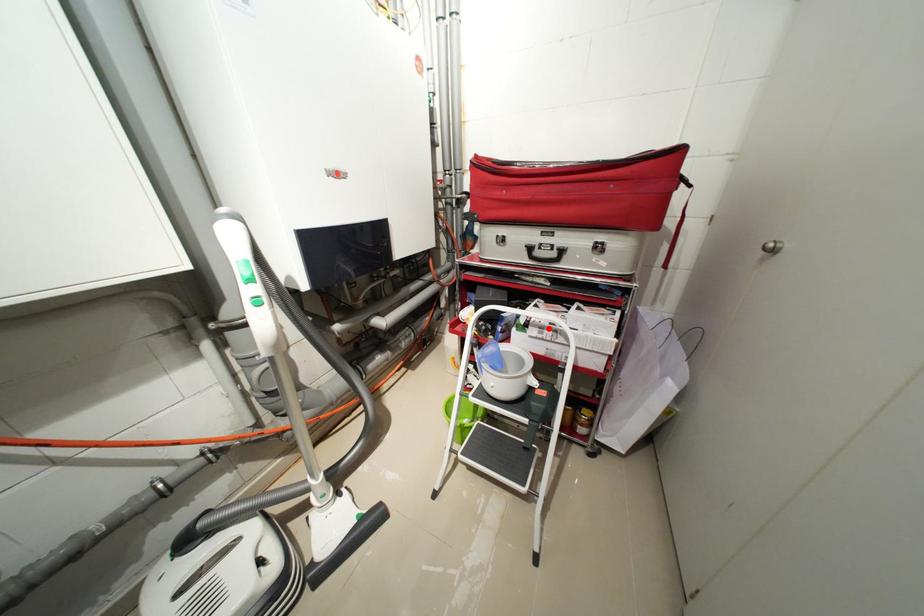
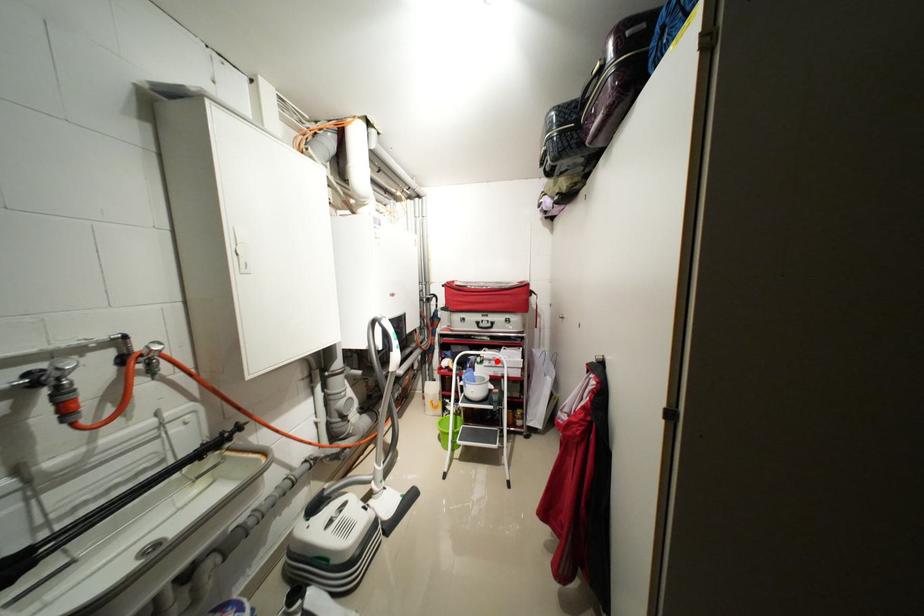
I am providing you with two images of the same scene from different viewpoints. A red point is marked on the first image and another point is marked on the second image. Is the marked point in image1 the same physical position as the marked point in image2?

Yes